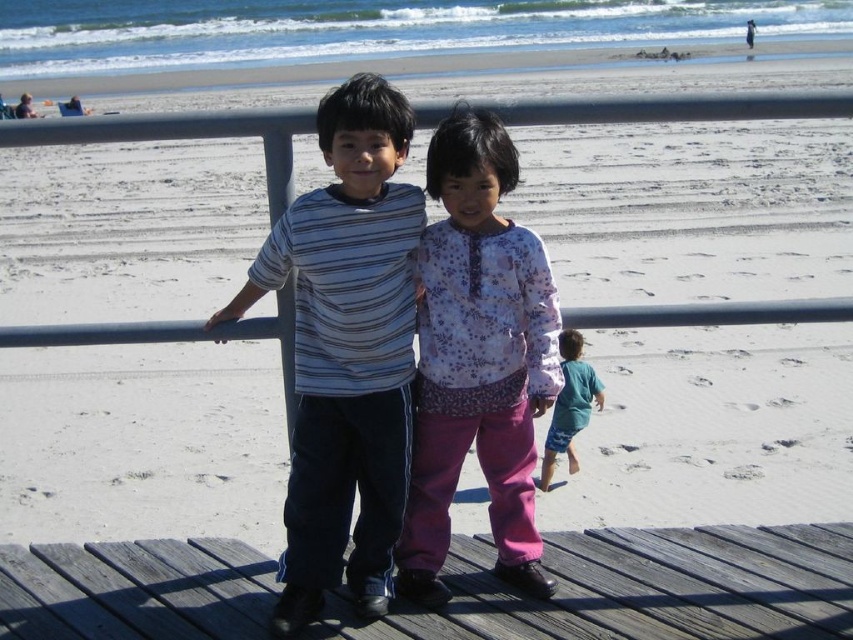
Question: Does striped cotton shirt at center appear under floral fabric shirt at center?

Choices:
 (A) no
 (B) yes

Answer: (A)

Question: Can you confirm if floral fabric shirt at center is positioned to the left of teal fabric shorts at lower right?

Choices:
 (A) no
 (B) yes

Answer: (B)

Question: Can you confirm if wooden at lower center is positioned to the right of teal fabric shorts at lower right?

Choices:
 (A) no
 (B) yes

Answer: (A)

Question: Among these objects, which one is farthest from the camera?

Choices:
 (A) floral fabric shirt at center
 (B) striped cotton shirt at center

Answer: (A)

Question: Which object appears farthest from the camera in this image?

Choices:
 (A) striped cotton shirt at center
 (B) wooden at lower center

Answer: (B)

Question: Considering the real-world distances, which object is farthest from the striped cotton shirt at center?

Choices:
 (A) teal fabric shorts at lower right
 (B) floral fabric shirt at center

Answer: (A)